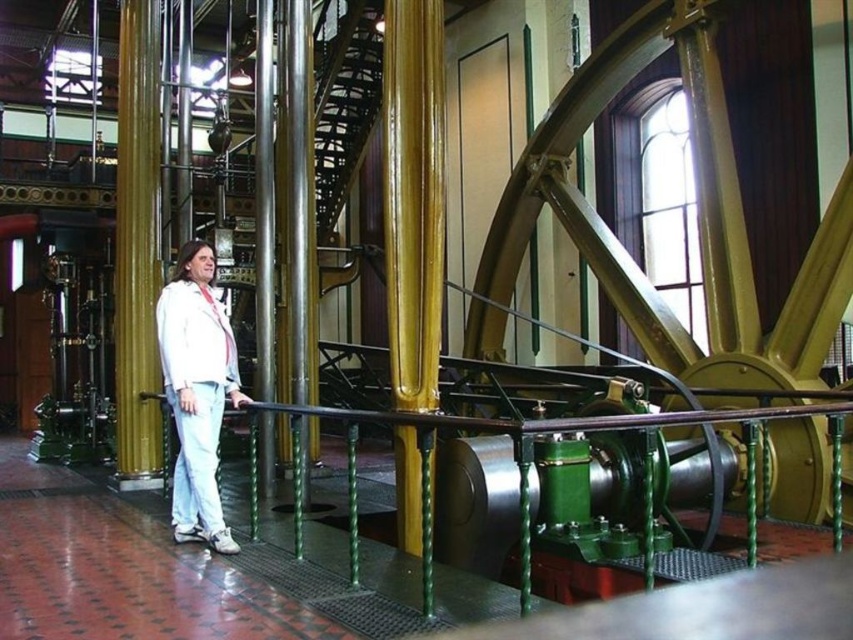
Based on the photo, can you confirm if gold polished metal pole at center is positioned to the left of gold polished pillar at center?

In fact, gold polished metal pole at center is to the right of gold polished pillar at center.

Does gold polished metal pole at center appear on the right side of gold polished pillar at center?

Yes, gold polished metal pole at center is to the right of gold polished pillar at center.

Does point (419, 454) come closer to viewer compared to point (146, 467)?

Yes, point (419, 454) is in front of point (146, 467).

The image size is (853, 640). I want to click on gold polished metal pole at center, so click(413, 196).

Does white matte jacket at center appear over polished metal pillar at center?

Incorrect, white matte jacket at center is not positioned above polished metal pillar at center.

Does point (224, 316) come closer to viewer compared to point (291, 212)?

Yes, it is in front of point (291, 212).

This screenshot has height=640, width=853. In order to click on white matte jacket at center in this screenshot , I will do `click(196, 392)`.

Is green polished metal railing at center positioned in front of polished metal pillar at center?

Yes, it is in front of polished metal pillar at center.

Does green polished metal railing at center have a lesser height compared to polished metal pillar at center?

Yes.

Which is behind, point (750, 460) or point (306, 124)?

Point (306, 124)

In order to click on green polished metal railing at center in this screenshot , I will do `click(527, 470)`.